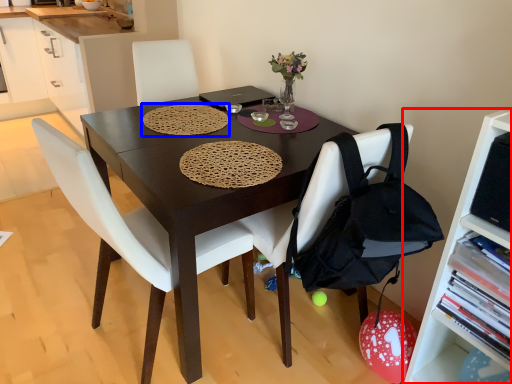
Question: Which object appears closest to the camera in this image, shelf (highlighted by a red box) or mat (highlighted by a blue box)?

Choices:
 (A) shelf
 (B) mat

Answer: (A)